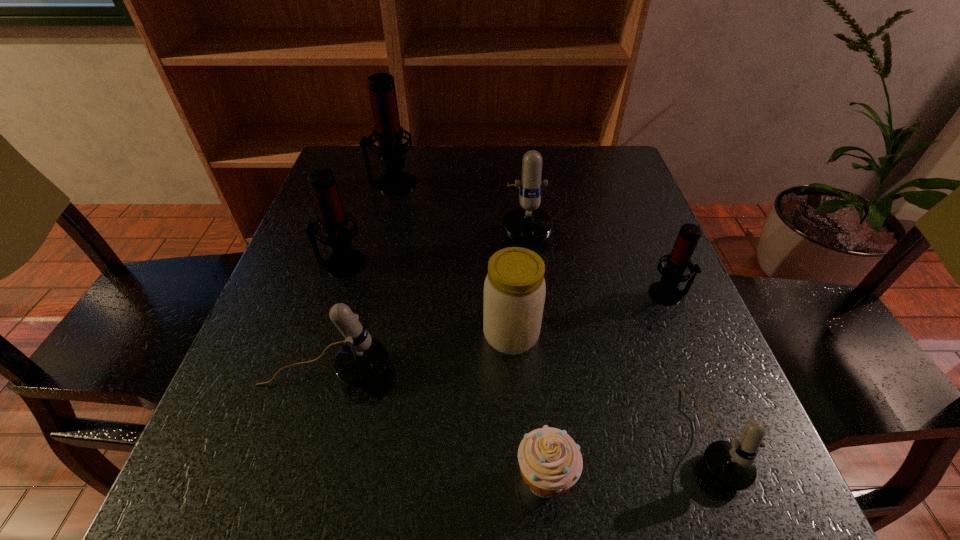
Locate an element on the screen. the shortest microphone is located at coordinates (731, 464).

Find the location of `muffin`. muffin is located at coordinates (550, 462).

Locate an element on the screen. The image size is (960, 540). vacant space located on the right of the tallest object is located at coordinates (540, 184).

The image size is (960, 540). I want to click on vacant space situated on the right of the second smallest red microphone, so click(475, 264).

What are the coordinates of `free location located on the front of the biggest white microphone` in the screenshot? It's located at (544, 395).

You are a GUI agent. You are given a task and a screenshot of the screen. Output one action in this format:
    pyautogui.click(x=<x>, y=<y>)
    Task: Click on the vacant space located on the right of the jar
    The image size is (960, 540).
    Given the screenshot: What is the action you would take?
    pyautogui.click(x=651, y=335)

Locate an element on the screen. blank space located on the right of the second biggest white microphone is located at coordinates (505, 372).

The height and width of the screenshot is (540, 960). In order to click on vacant space located on the front of the fourth farthest microphone in this screenshot , I will do `click(709, 394)`.

Where is `vacant region located on the left of the rightmost white microphone`? The image size is (960, 540). vacant region located on the left of the rightmost white microphone is located at coordinates (420, 438).

The width and height of the screenshot is (960, 540). In order to click on vacant space located on the back of the muffin in this screenshot , I will do `click(523, 262)`.